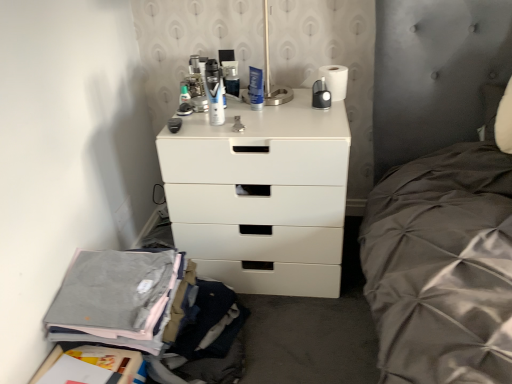
Question: Considering the positions of metallic silver can at center, which is the third toiletry from front to back, and gray cotton pants at lower left in the image, is metallic silver can at center, which is the third toiletry from front to back, bigger or smaller than gray cotton pants at lower left?

Choices:
 (A) big
 (B) small

Answer: (B)

Question: Relative to gray cotton pants at lower left, is metallic silver can at center, the first toiletry from the back, in front or behind?

Choices:
 (A) front
 (B) behind

Answer: (B)

Question: Which object is the closest to the white plastic chest of drawers at center?

Choices:
 (A) metallic silver can at center, which is the third toiletry from front to back
 (B) translucent plastic toothbrush at upper center, the second toiletry from the front
 (C) matte black shaving cream can at center, acting as the 3th toiletry starting from the back
 (D) gray cotton pants at lower left

Answer: (C)

Question: Which is nearer to the translucent plastic toothbrush at upper center, the second toiletry from the front?

Choices:
 (A) matte black shaving cream can at center, the second toiletry in the left-to-right sequence
 (B) white plastic chest of drawers at center
 (C) metallic silver can at center, which is the third toiletry from front to back
 (D) gray cotton pants at lower left

Answer: (A)